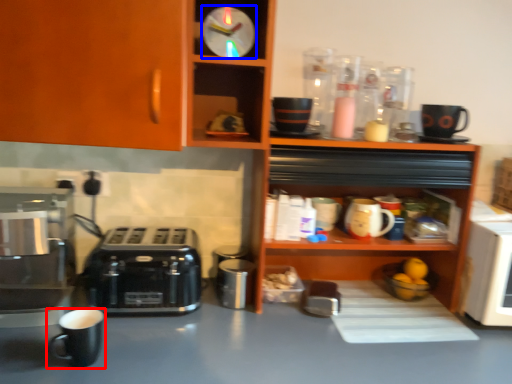
Question: Which of the following is the closest to the observer, coffee cup (highlighted by a red box) or clock (highlighted by a blue box)?

Choices:
 (A) coffee cup
 (B) clock

Answer: (A)